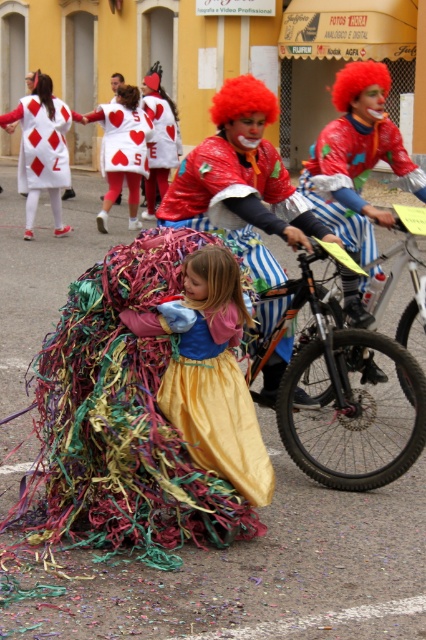
You are a photographer trying to capture the perfect shot of the gold satin dress at center and the matte red heart at center during the parade. Since you want both objects to appear balanced in the photo, which object should you zoom in on more to make them look similar in size?

The gold satin dress at center is smaller than the matte red heart at center, so you should zoom in more on the gold satin dress at center to make it appear larger and balance its size with the matte red heart at center in the photo.

You are standing in the street scene and want to determine which of the two points, point [314,157] or point [175,164], is nearer to you. Based on the scene description, which point is closer?

Point [314,157] is closer to the viewer than point [175,164].